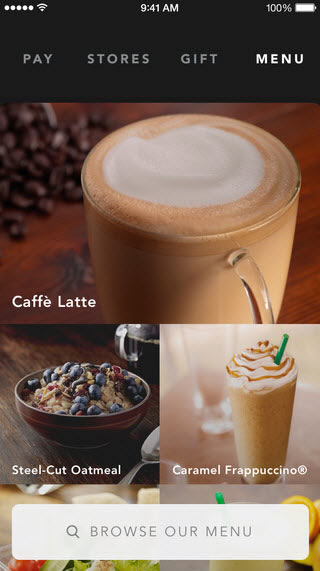
Where is `silver spoon next to oatmeal bowl`? silver spoon next to oatmeal bowl is located at coordinates (140, 464).